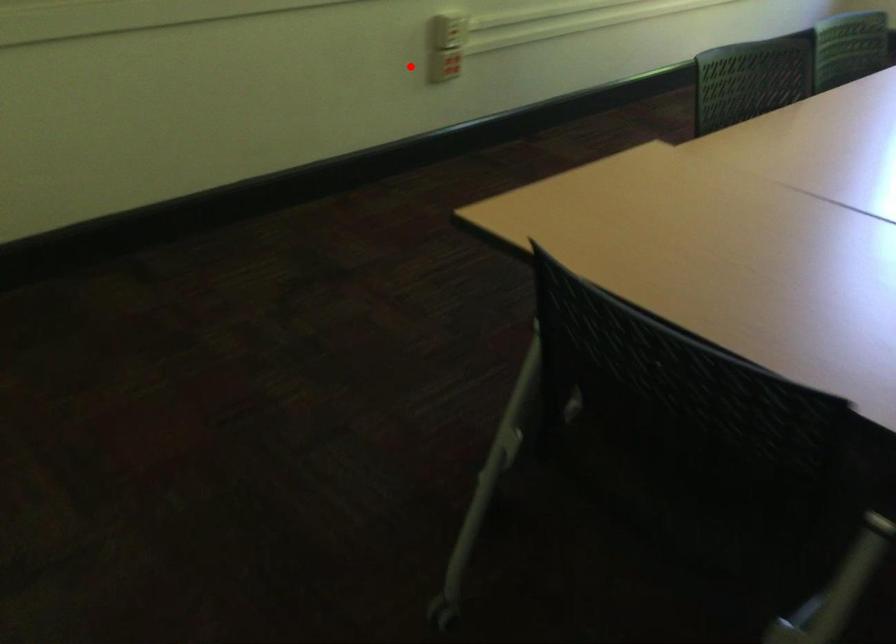
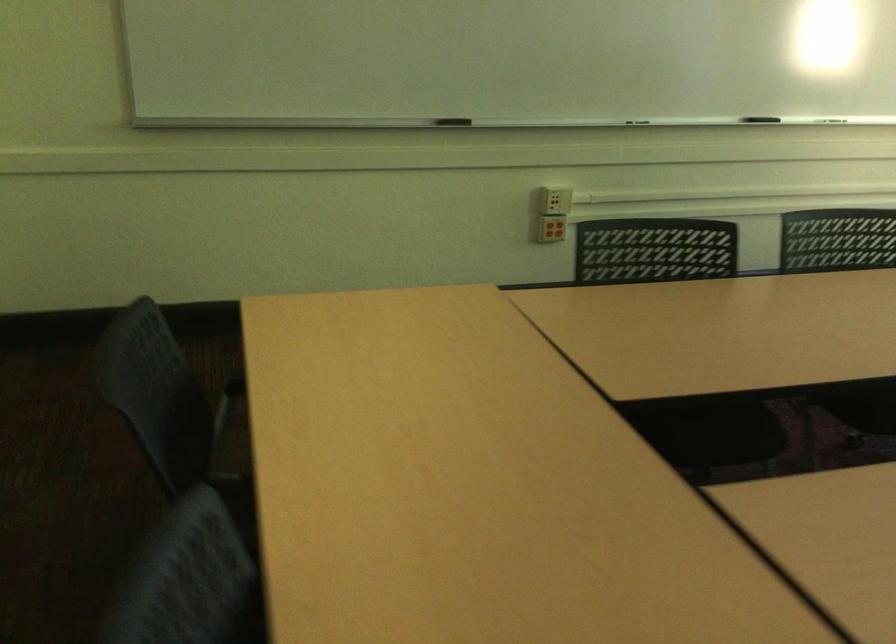
Question: I am providing you with two images of the same scene from different viewpoints. In image1, a red point is highlighted. Considering the same 3D point in image2, which of the following is correct?

Choices:
 (A) It is closer
 (B) It is farther

Answer: (B)